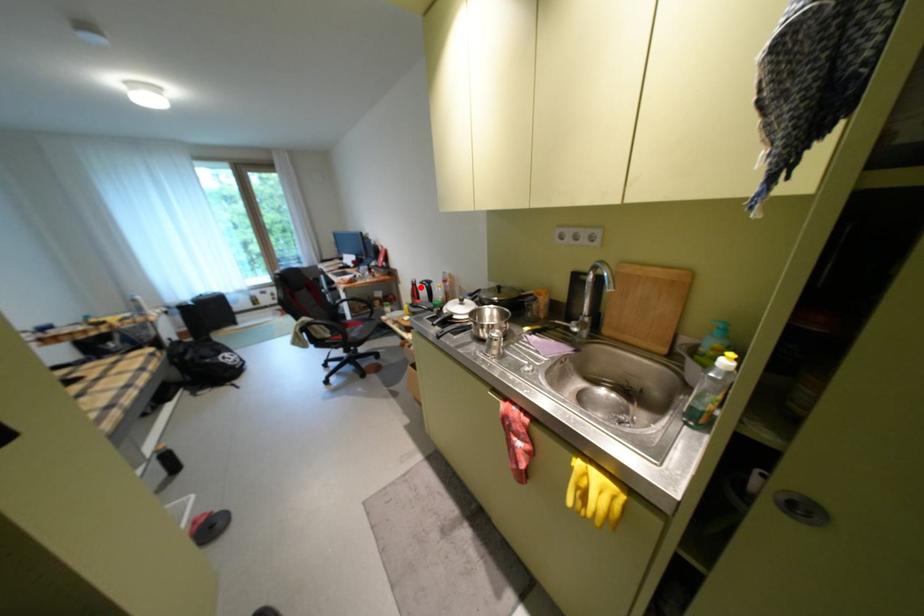
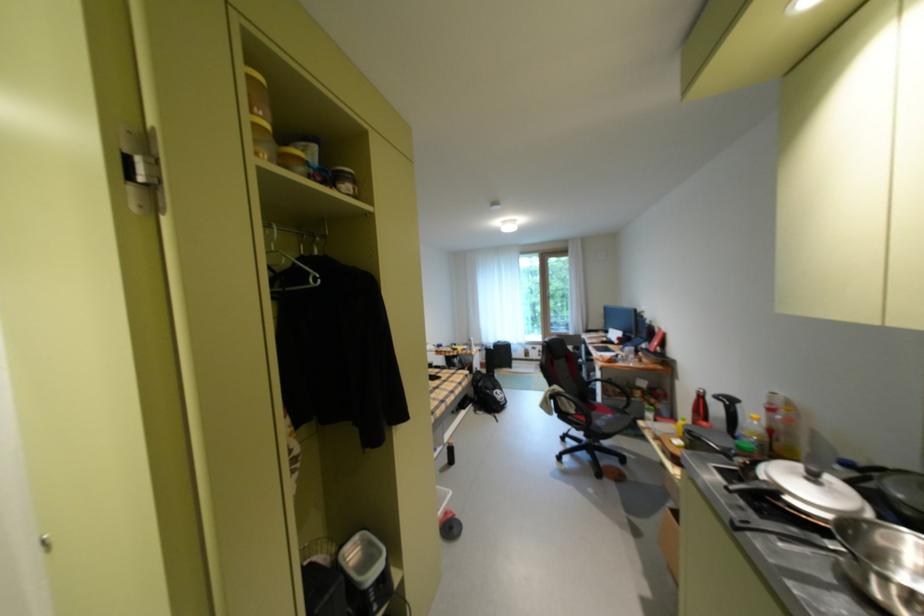
Question: I am providing you with two images of the same scene from different viewpoints. A red point is shown in image1. For the corresponding object point in image2, is it positioned nearer or farther from the camera?

Choices:
 (A) Nearer
 (B) Farther

Answer: (A)